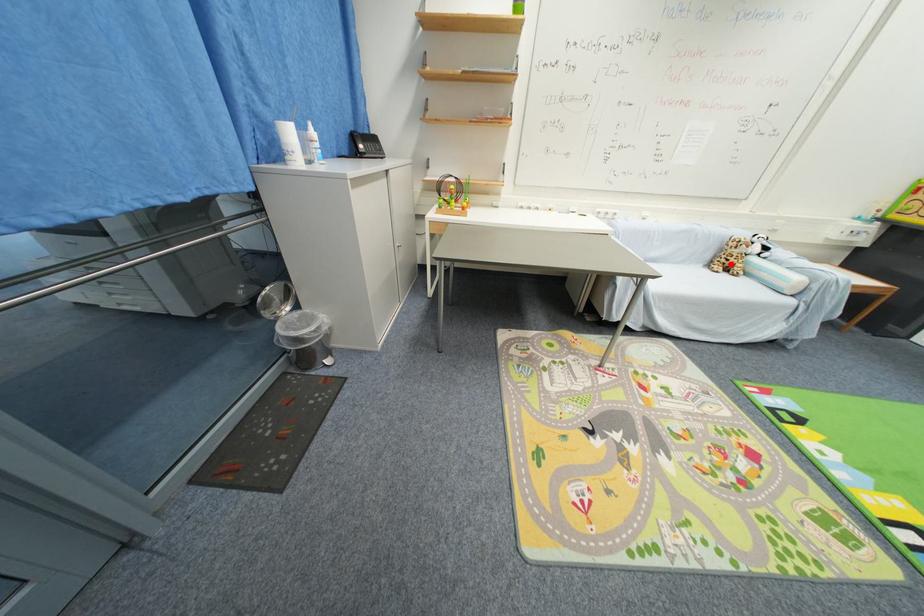
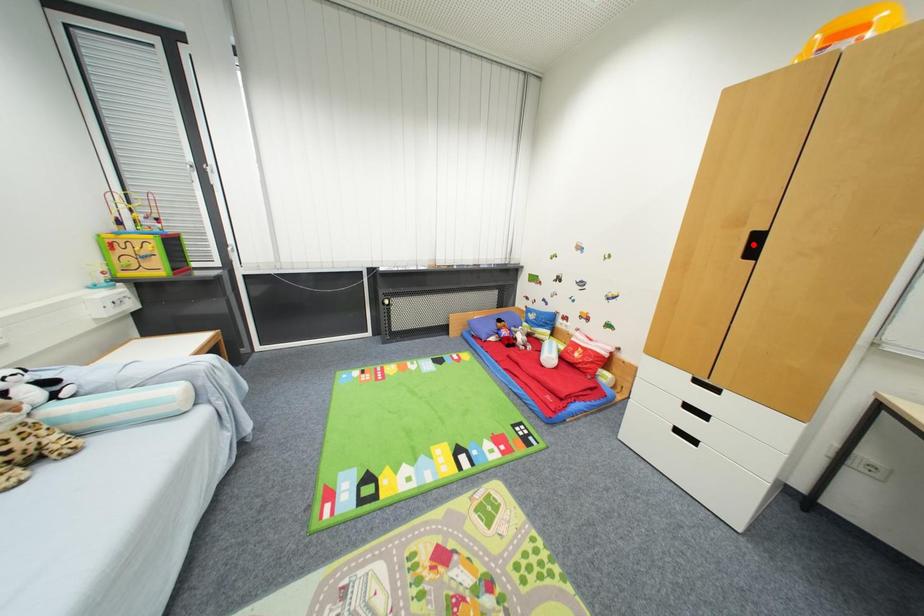
I am providing you with two images of the same scene from different viewpoints. A red point is marked on the first image and another point is marked on the second image. Does the point marked in image1 correspond to the same location as the one in image2?

No